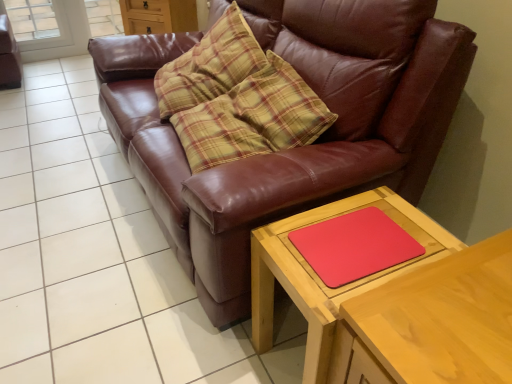
Find the location of a particular element. vacant area to the right of matte brown swivel chair at upper left is located at coordinates (61, 78).